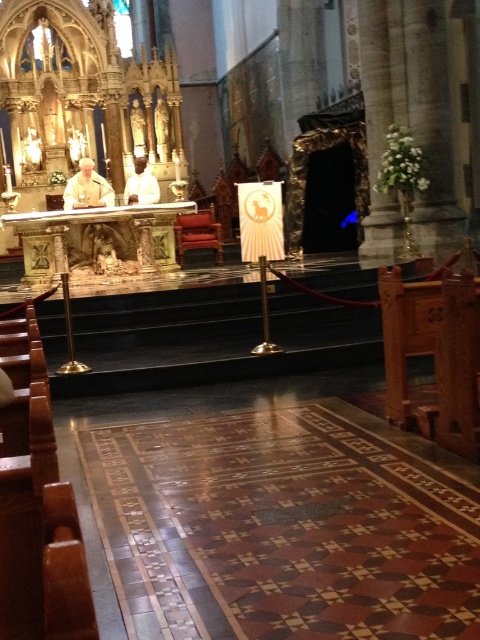
Question: Which of the following is the closest to the observer?

Choices:
 (A) (88, 186)
 (B) (142, 164)

Answer: (A)

Question: Does matte white robe at center lie in front of white cloth at center?

Choices:
 (A) yes
 (B) no

Answer: (A)

Question: Which point is farther to the camera?

Choices:
 (A) matte white robe at center
 (B) white cloth at center

Answer: (B)

Question: Which object is closer to the camera taking this photo?

Choices:
 (A) white cloth at center
 (B) matte white robe at center

Answer: (B)

Question: Can you confirm if matte white robe at center is positioned above white cloth at center?

Choices:
 (A) no
 (B) yes

Answer: (A)

Question: Is matte white robe at center to the right of white cloth at center from the viewer's perspective?

Choices:
 (A) no
 (B) yes

Answer: (A)